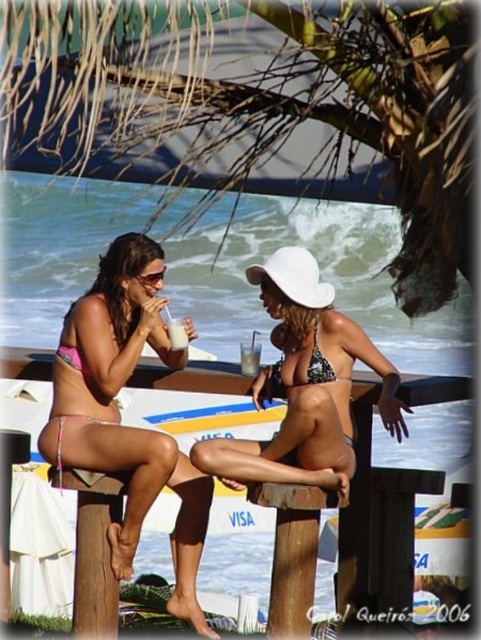
The height and width of the screenshot is (640, 481). What do you see at coordinates (250, 356) in the screenshot?
I see `white matte cup at center` at bounding box center [250, 356].

Is white matte cup at center thinner than white frothy drink at center?

Yes.

At what (x,y) coordinates should I click in order to perform the action: click on white matte cup at center. Please return your answer as a coordinate pair (x, y). This screenshot has width=481, height=640. Looking at the image, I should click on (250, 356).

Identify the location of white matte cup at center. Image resolution: width=481 pixels, height=640 pixels. (250, 356).

Between printed bikini at center and white matte cup at center, which one is positioned lower?

printed bikini at center

Is the position of printed bikini at center more distant than that of white matte cup at center?

No, it is in front of white matte cup at center.

Measure the distance between printed bikini at center and camera.

They are 77.71 feet apart.

Where is `printed bikini at center`? The width and height of the screenshot is (481, 640). printed bikini at center is located at coordinates (304, 385).

Who is lower down, printed bikini at center or white frothy drink at center?

printed bikini at center is below.

Locate an element on the screen. printed bikini at center is located at coordinates (304, 385).